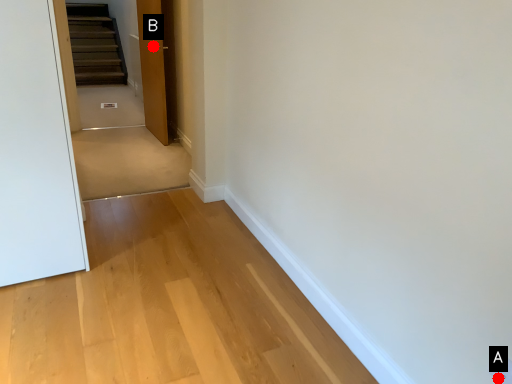
Question: Two points are circled on the image, labeled by A and B beside each circle. Which point appears farthest from the camera in this image?

Choices:
 (A) A is further
 (B) B is further

Answer: (B)